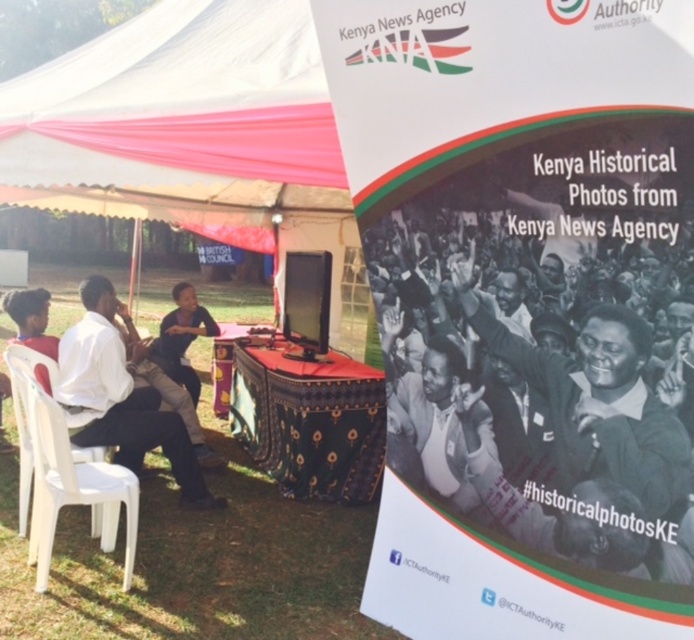
You are a photographer at the event. You need to capture a photo of the white matte shirt at left and the white plastic chair at left. Which object is taller?

The white matte shirt at left is much taller than the white plastic chair at left.

You are a photographer at the event and want to take a photo of the patterned fabric table at center and the white matte shirt at left. Which object should be placed lower in the photo to ensure both are visible?

The patterned fabric table at center is located below the white matte shirt at left, so to ensure both are visible in the photo, the patterned fabric table at center should be placed lower in the photo.